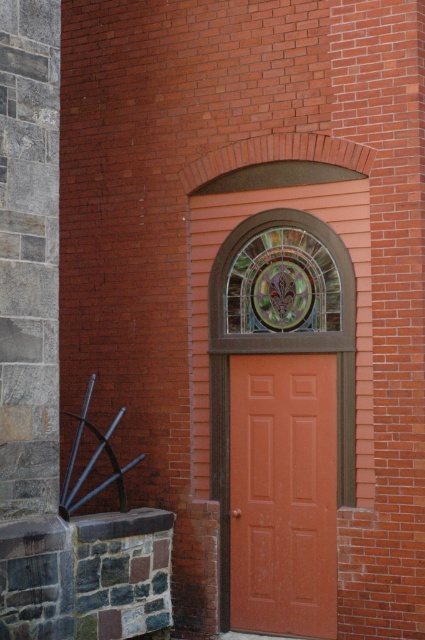
Question: Observing the image, what is the correct spatial positioning of matte orange door at center in reference to stained glass window at center?

Choices:
 (A) above
 (B) below

Answer: (B)

Question: Among these objects, which one is nearest to the camera?

Choices:
 (A) matte orange door at center
 (B) stained glass window at center

Answer: (A)

Question: Can you confirm if matte orange door at center is smaller than stained glass window at center?

Choices:
 (A) no
 (B) yes

Answer: (A)

Question: Which of the following is the closest to the observer?

Choices:
 (A) (317, 390)
 (B) (254, 278)

Answer: (A)

Question: Can you confirm if matte orange door at center is thinner than stained glass window at center?

Choices:
 (A) yes
 (B) no

Answer: (A)